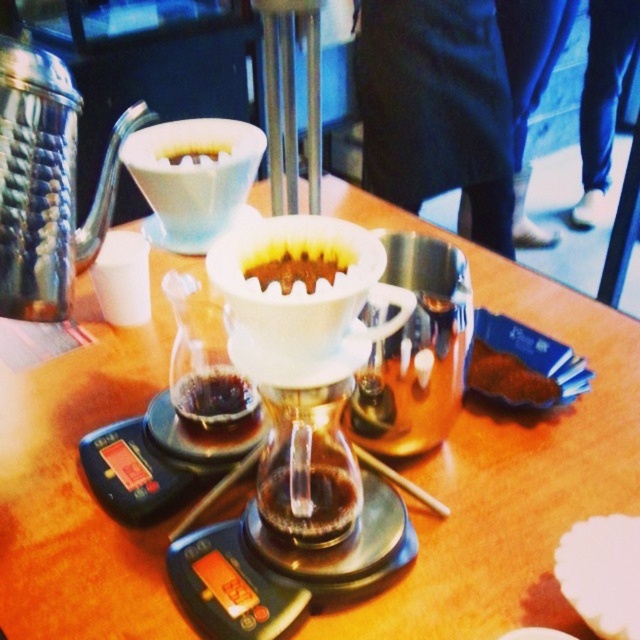
Which is below, brown crumbly cookie at lower right or white matte coffee filter at center?

brown crumbly cookie at lower right is lower down.

Locate an element on the screen. Image resolution: width=640 pixels, height=640 pixels. brown crumbly cookie at lower right is located at coordinates (508, 378).

What do you see at coordinates (508, 378) in the screenshot?
I see `brown crumbly cookie at lower right` at bounding box center [508, 378].

You are a GUI agent. You are given a task and a screenshot of the screen. Output one action in this format:
    pyautogui.click(x=<x>, y=<y>)
    Task: Click on the brown crumbly cookie at lower right
    The height and width of the screenshot is (640, 640).
    Given the screenshot: What is the action you would take?
    click(508, 378)

Can you confirm if transparent glass carafe at center is wider than brushed metal teapot at left?

Yes.

Between point (256, 547) and point (40, 296), which one is positioned in front?

Point (40, 296)

I want to click on transparent glass carafe at center, so click(296, 429).

Which is below, translucent glass carafe at center or brown crumbly cookie at lower right?

brown crumbly cookie at lower right is below.

Is translucent glass carafe at center in front of brown crumbly cookie at lower right?

Yes, it is in front of brown crumbly cookie at lower right.

Image resolution: width=640 pixels, height=640 pixels. What do you see at coordinates (504, 468) in the screenshot? I see `translucent glass carafe at center` at bounding box center [504, 468].

Locate an element on the screen. translucent glass carafe at center is located at coordinates (504, 468).